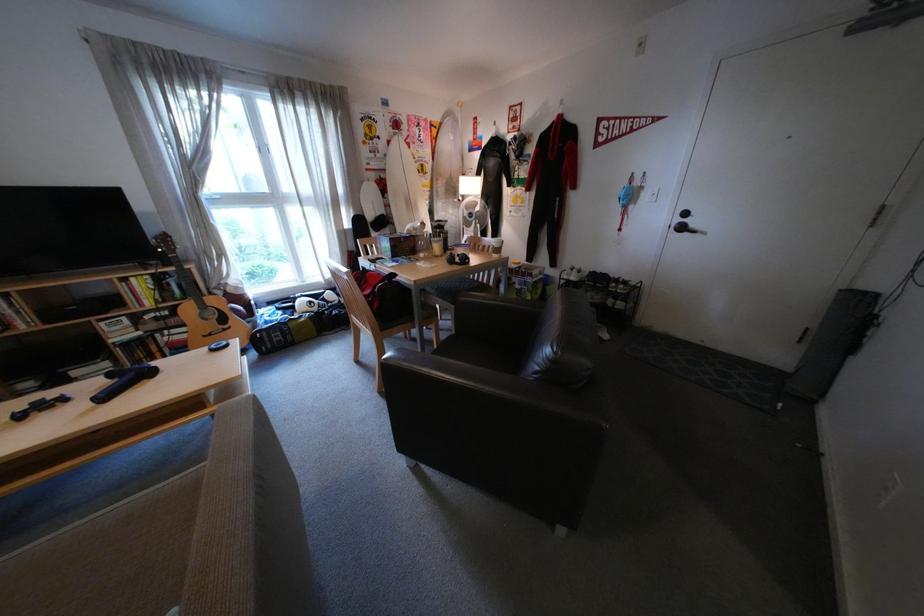
Locate an element on the screen. The width and height of the screenshot is (924, 616). acoustic guitar is located at coordinates (202, 307).